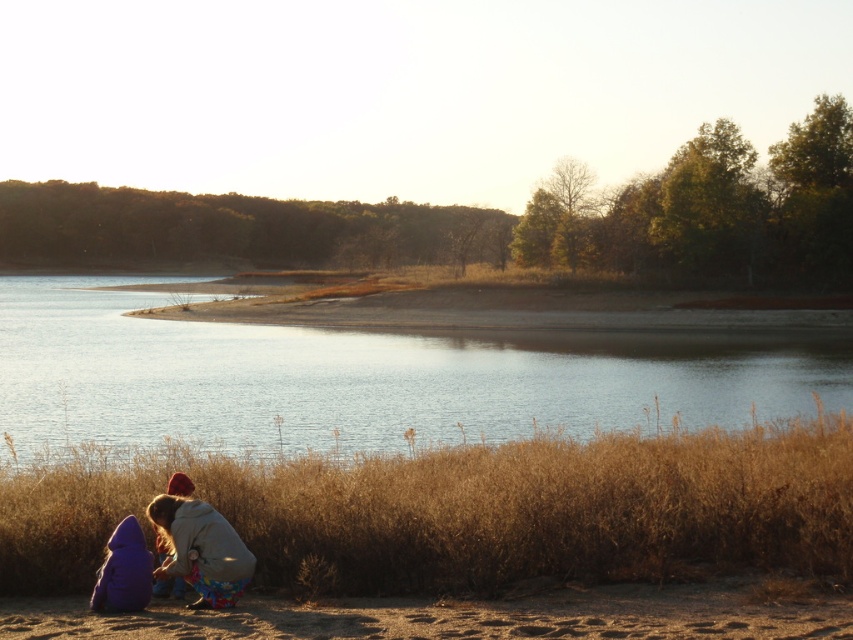
Does brown sandy ground at lower left have a lesser height compared to purple fleece jacket at lower left?

Yes.

Is brown sandy ground at lower left bigger than purple fleece jacket at lower left?

Actually, brown sandy ground at lower left might be smaller than purple fleece jacket at lower left.

Who is more distant from viewer, (722, 628) or (167, 486)?

The point (167, 486) is behind.

Locate an element on the screen. The image size is (853, 640). brown sandy ground at lower left is located at coordinates (469, 614).

Which of these two, clear blue water at center or purple fleece jacket at lower left, stands taller?

clear blue water at center is taller.

Who is higher up, clear blue water at center or purple fleece jacket at lower left?

Positioned higher is clear blue water at center.

Which is in front, point (225, 349) or point (190, 518)?

Point (190, 518)

Locate an element on the screen. clear blue water at center is located at coordinates (367, 378).

Does clear blue water at center appear on the right side of brown sandy ground at lower left?

Incorrect, clear blue water at center is not on the right side of brown sandy ground at lower left.

I want to click on clear blue water at center, so click(367, 378).

Image resolution: width=853 pixels, height=640 pixels. I want to click on clear blue water at center, so click(x=367, y=378).